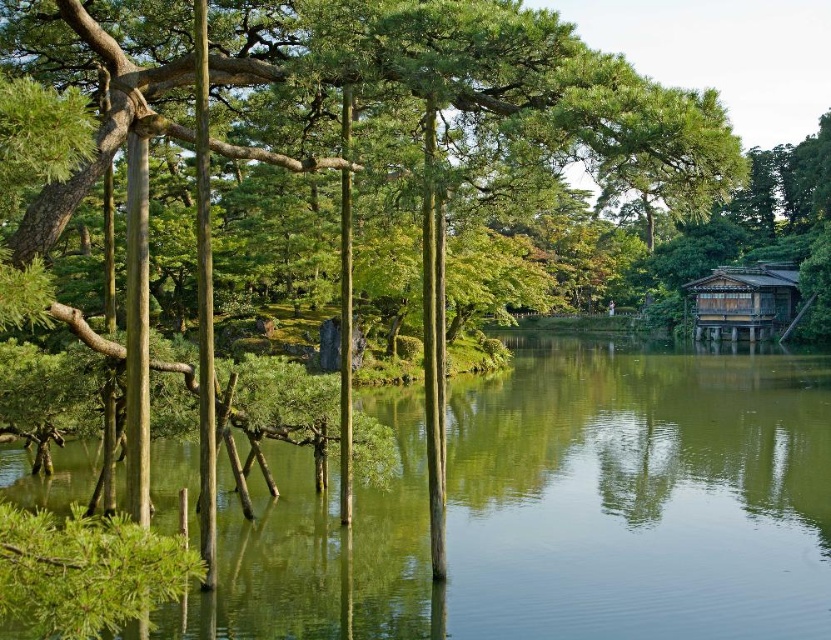
Which is behind, point (692, 532) or point (711, 308)?

The point (711, 308) is more distant.

Which is in front, point (509, 554) or point (772, 323)?

Positioned in front is point (509, 554).

Identify the location of green reflective water at center. (559, 509).